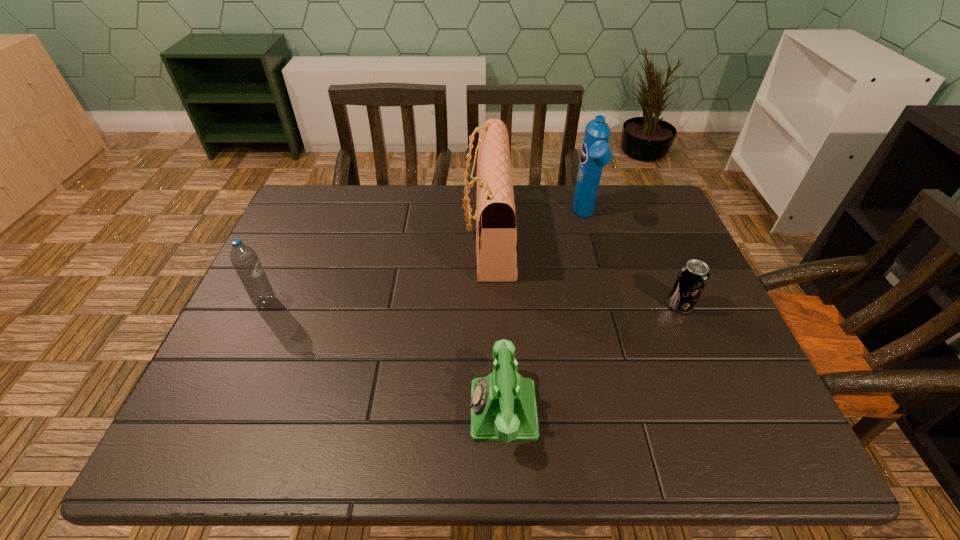
Where is `unoccupied position between the nearest object and the soda can`? The height and width of the screenshot is (540, 960). unoccupied position between the nearest object and the soda can is located at coordinates (591, 357).

Where is `empty location between the soda can and the shampoo`? Image resolution: width=960 pixels, height=540 pixels. empty location between the soda can and the shampoo is located at coordinates (632, 261).

At what (x,y) coordinates should I click in order to perform the action: click on free area in between the handbag and the second object from right to left. Please return your answer as a coordinate pair (x, y). The image size is (960, 540). Looking at the image, I should click on (537, 225).

Where is `unoccupied area between the third tallest object and the nearest object`? Image resolution: width=960 pixels, height=540 pixels. unoccupied area between the third tallest object and the nearest object is located at coordinates (384, 356).

Where is `blank region between the telephone and the handbag`? Image resolution: width=960 pixels, height=540 pixels. blank region between the telephone and the handbag is located at coordinates (495, 321).

The height and width of the screenshot is (540, 960). I want to click on free space that is in between the soda can and the shampoo, so click(632, 261).

In order to click on vacant space in between the soda can and the telephone in this screenshot , I will do `click(591, 357)`.

Where is `object identified as the third closest to the soda can`? The width and height of the screenshot is (960, 540). object identified as the third closest to the soda can is located at coordinates (503, 407).

Find the location of a particular element. This screenshot has height=540, width=960. object that stands as the closest to the second tallest object is located at coordinates coord(596,153).

Find the location of a particular element. vacant point that satisfies the following two spatial constraints: 1. on the back side of the water bottle; 2. on the left side of the fourth object from left to right is located at coordinates (305, 217).